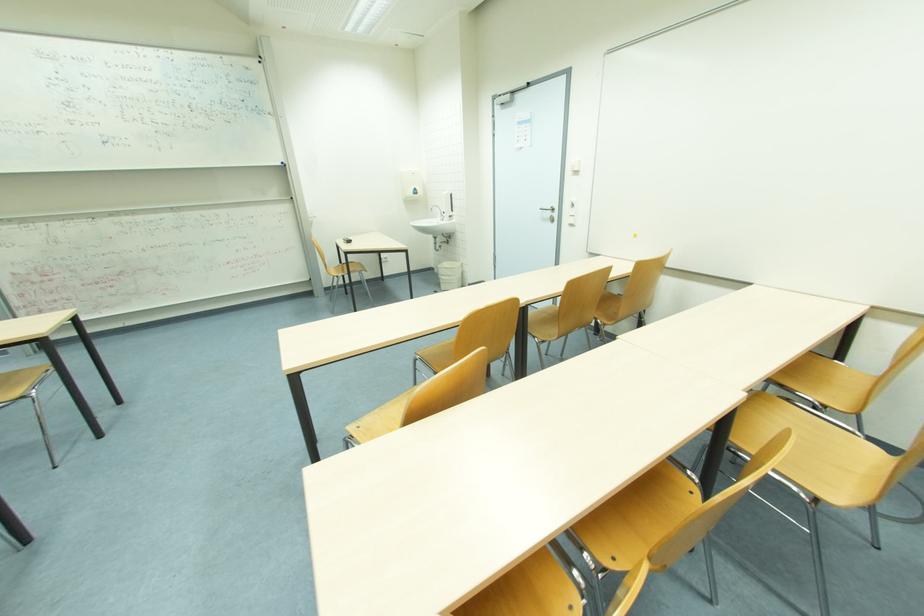
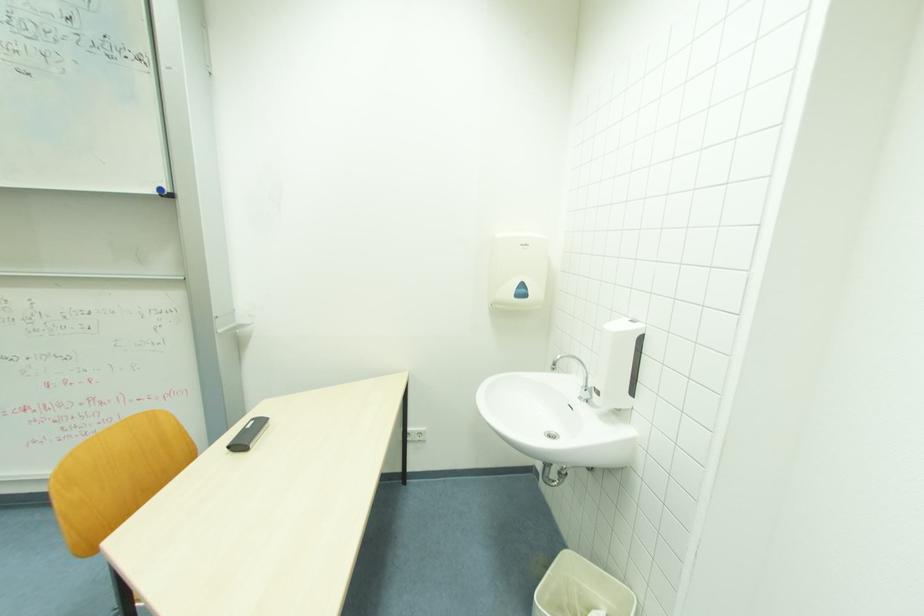
Question: In a continuous first-person perspective shot, in which direction is the camera moving?

Choices:
 (A) Left
 (B) Right
 (C) Forward
 (D) Backward

Answer: (C)